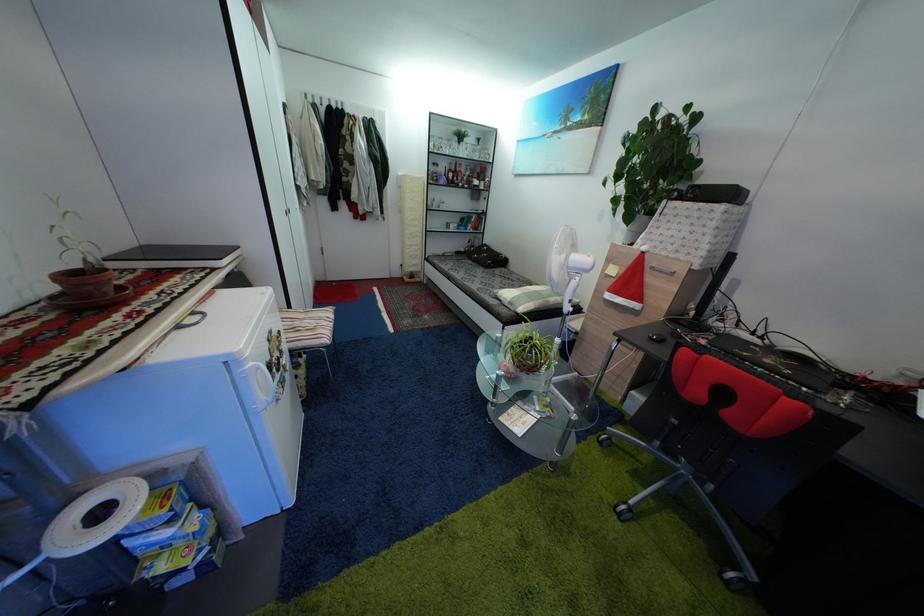
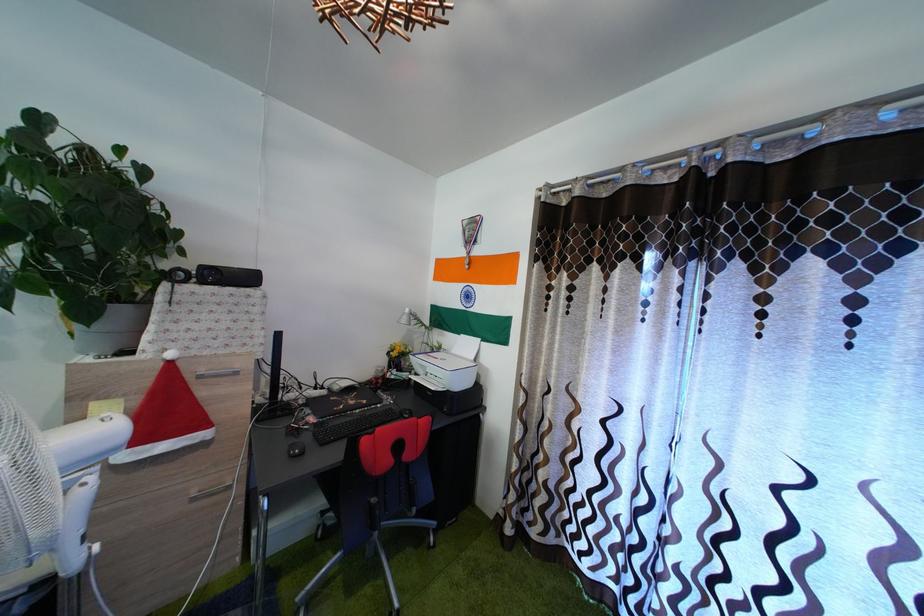
In the second image, find the point that corresponds to the point at 649,225 in the first image.

(128, 318)